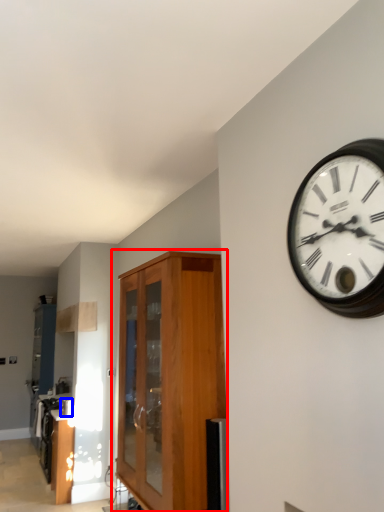
Question: Among these objects, which one is nearest to the camera, cabinetry (highlighted by a red box) or appliance (highlighted by a blue box)?

Choices:
 (A) cabinetry
 (B) appliance

Answer: (A)